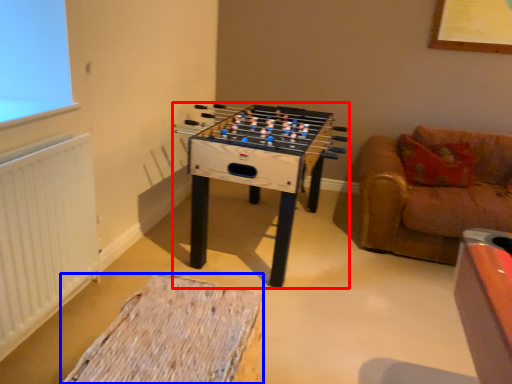
Question: Which object appears farthest to the camera in this image, table (highlighted by a red box) or furniture (highlighted by a blue box)?

Choices:
 (A) table
 (B) furniture

Answer: (A)